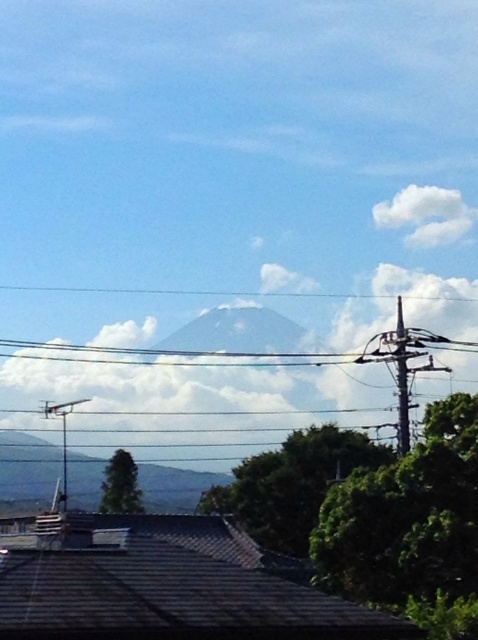
Question: In this image, where is green leafy tree at center located relative to green leafy tree at lower left?

Choices:
 (A) below
 (B) above

Answer: (B)

Question: Among these objects, which one is farthest from the camera?

Choices:
 (A) green leafy tree at right
 (B) white fluffy cloud at upper right

Answer: (B)

Question: Does gray rocky mountain at center have a smaller size compared to green leafy tree at lower left?

Choices:
 (A) no
 (B) yes

Answer: (A)

Question: Which object is the farthest from the green leafy tree at center?

Choices:
 (A) green leafy tree at right
 (B) metallic gray pole at right
 (C) green leafy tree at lower left
 (D) white fluffy cloud at upper right

Answer: (D)

Question: Does green leafy tree at right appear over gray rocky mountain at center?

Choices:
 (A) no
 (B) yes

Answer: (B)

Question: Which object is the closest to the white fluffy cloud at upper right?

Choices:
 (A) gray rocky mountain at center
 (B) green leafy tree at center
 (C) green leafy tree at right
 (D) metallic gray pole at right

Answer: (A)